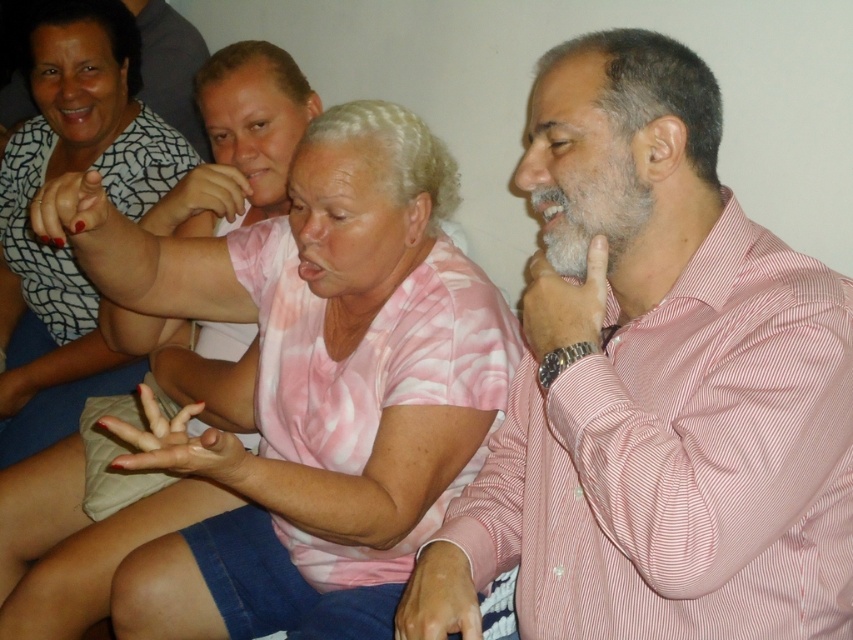
Does point (514, 547) come farther from viewer compared to point (16, 400)?

That is False.

Between point (640, 321) and point (48, 106), which one is positioned behind?

Point (48, 106)

Identify the location of pink striped shirt at right. (654, 387).

Consider the image. Does pink striped shirt at right lie behind pink tie-dye shirt at center?

No, pink striped shirt at right is in front of pink tie-dye shirt at center.

The height and width of the screenshot is (640, 853). What are the coordinates of `pink striped shirt at right` in the screenshot? It's located at (654, 387).

Who is positioned more to the left, pink tie-dye shirt at center or matte black shirt at upper left?

matte black shirt at upper left is more to the left.

In order to click on pink tie-dye shirt at center in this screenshot , I will do 294,394.

The width and height of the screenshot is (853, 640). In order to click on pink tie-dye shirt at center in this screenshot , I will do `click(294, 394)`.

The height and width of the screenshot is (640, 853). I want to click on pink tie-dye shirt at center, so click(294, 394).